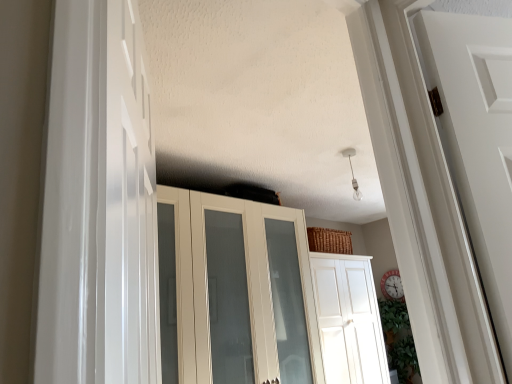
The height and width of the screenshot is (384, 512). Find the location of `white glossy cupboard at center`. white glossy cupboard at center is located at coordinates 247,283.

What do you see at coordinates (349, 319) in the screenshot?
I see `white glossy door at center, the 2th door in the top-to-bottom sequence` at bounding box center [349, 319].

Identify the location of white glossy cupboard at center. (247, 283).

Is white glossy door at left, arranged as the 2th door when viewed from the right, far away from white glossy cupboard at center?

Yes, white glossy door at left, arranged as the 2th door when viewed from the right, and white glossy cupboard at center are located far from each other.

Which object is positioned more to the right, white glossy door at left, arranged as the 2th door when viewed from the right, or white glossy cupboard at center?

white glossy cupboard at center.

You are a GUI agent. You are given a task and a screenshot of the screen. Output one action in this format:
    pyautogui.click(x=<x>, y=<y>)
    Task: Click on the door that is in front of the white glossy cupboard at center
    
    Given the screenshot: What is the action you would take?
    pyautogui.click(x=130, y=207)

Is white glossy door at left, which is counted as the 1th door, starting from the front, turned away from white glossy cupboard at center?

No.

Consider the image. Which object is more forward, white glossy door at left, positioned as the second door in back-to-front order, or white glossy door at center, acting as the second door starting from the left?

white glossy door at left, positioned as the second door in back-to-front order, is in front.

Can you confirm if white glossy door at left, positioned as the second door in back-to-front order, is bigger than white glossy door at center, the 1th door in the back-to-front sequence?

No.

Is white glossy door at left, which is counted as the 1th door, starting from the front, to the left of white glossy door at center, the 2th door positioned from the front, from the viewer's perspective?

Correct, you'll find white glossy door at left, which is counted as the 1th door, starting from the front, to the left of white glossy door at center, the 2th door positioned from the front.

Could you tell me if white glossy door at left, positioned as the second door in back-to-front order, is turned towards white glossy door at center, which appears as the 1th door when ordered from the bottom?

No, white glossy door at left, positioned as the second door in back-to-front order, does not turn towards white glossy door at center, which appears as the 1th door when ordered from the bottom.

Is point (348, 348) behind point (186, 251)?

Yes, point (348, 348) is farther from viewer.

From the image's perspective, who appears lower, white glossy door at center, the 2th door positioned from the front, or white glossy cupboard at center?

white glossy door at center, the 2th door positioned from the front, from the image's perspective.

What's the angular difference between white glossy door at center, which appears as the 1th door when ordered from the bottom, and white glossy cupboard at center's facing directions?

The angle between the facing direction of white glossy door at center, which appears as the 1th door when ordered from the bottom, and the facing direction of white glossy cupboard at center is 0.749 degrees.

Would you consider white glossy door at center, acting as the second door starting from the left, to be distant from white glossy cupboard at center?

white glossy door at center, acting as the second door starting from the left, is actually quite close to white glossy cupboard at center.

Which of these two, white glossy cupboard at center or white glossy door at center, which appears as the 1th door when ordered from the bottom, stands shorter?

Standing shorter between the two is white glossy door at center, which appears as the 1th door when ordered from the bottom.

Considering the relative positions of white glossy cupboard at center and white glossy door at center, the 2th door positioned from the front, in the image provided, is white glossy cupboard at center in front of white glossy door at center, the 2th door positioned from the front,?

That is True.

Is white glossy door at center, the 2th door in the top-to-bottom sequence, surrounded by white glossy cupboard at center?

That's incorrect, white glossy door at center, the 2th door in the top-to-bottom sequence, is not inside white glossy cupboard at center.

Between white glossy door at center, acting as the second door starting from the left, and white glossy door at left, arranged as the 2th door when viewed from the right, which one is positioned behind?

white glossy door at center, acting as the second door starting from the left, is behind.

Locate an element on the screen. door in front of the white glossy door at center, the 2th door positioned from the front is located at coordinates (130, 207).

From the image's perspective, who appears lower, white glossy door at center, marked as the first door in a right-to-left arrangement, or white glossy door at left, positioned as the second door in back-to-front order?

white glossy door at center, marked as the first door in a right-to-left arrangement.

How much distance is there between white glossy door at center, the 2th door positioned from the front, and white glossy door at left, arranged as the 2th door when viewed from the right?

A distance of 2.48 meters exists between white glossy door at center, the 2th door positioned from the front, and white glossy door at left, arranged as the 2th door when viewed from the right.

What's the angular difference between white glossy cupboard at center and white glossy door at left, which is counted as the 1th door, starting from the front,'s facing directions?

The angle between the facing direction of white glossy cupboard at center and the facing direction of white glossy door at left, which is counted as the 1th door, starting from the front, is 56.3 degrees.

The height and width of the screenshot is (384, 512). I want to click on cupboard directly beneath the white glossy door at left, the second door when ordered from bottom to top (from a real-world perspective), so click(x=247, y=283).

Considering the sizes of objects white glossy cupboard at center and white glossy door at left, positioned as the second door in back-to-front order, in the image provided, who is thinner, white glossy cupboard at center or white glossy door at left, positioned as the second door in back-to-front order,?

Thinner between the two is white glossy door at left, positioned as the second door in back-to-front order.

Choose the correct answer: Is white glossy cupboard at center inside white glossy door at left, which is counted as the 1th door, starting from the front, or outside it?

white glossy cupboard at center is outside white glossy door at left, which is counted as the 1th door, starting from the front.

I want to click on cupboard that appears below the white glossy door at left, positioned as the second door in back-to-front order (from the image's perspective), so click(247, 283).

What are the coordinates of `door positioned vertically above the white glossy door at center, the 1th door in the back-to-front sequence (from a real-world perspective)` in the screenshot? It's located at (130, 207).

In the scene shown: From the image, which object appears to be nearer to white glossy cupboard at center, white glossy door at center, marked as the first door in a right-to-left arrangement, or white glossy door at left, which is counted as the 1th door, starting from the front?

Based on the image, white glossy door at center, marked as the first door in a right-to-left arrangement, appears to be nearer to white glossy cupboard at center.

Estimate the real-world distances between objects in this image. Which object is further from white glossy door at center, acting as the second door starting from the left, white glossy cupboard at center or white glossy door at left, the second door when ordered from bottom to top?

Among the two, white glossy door at left, the second door when ordered from bottom to top, is located further to white glossy door at center, acting as the second door starting from the left.

Based on their spatial positions, is white glossy door at left, which is counted as the 1th door, starting from the front, or white glossy cupboard at center closer to white glossy door at center, the 2th door in the top-to-bottom sequence?

The object closer to white glossy door at center, the 2th door in the top-to-bottom sequence, is white glossy cupboard at center.

Looking at the image, which one is located closer to white glossy door at left, the second door when ordered from bottom to top, white glossy door at center, the 2th door positioned from the front, or white glossy cupboard at center?

Among the two, white glossy cupboard at center is located nearer to white glossy door at left, the second door when ordered from bottom to top.

Considering their positions, is white glossy door at left, the first door from the top, positioned closer to white glossy cupboard at center than white glossy door at center, the 1th door in the back-to-front sequence?

white glossy door at center, the 1th door in the back-to-front sequence, is positioned closer to the anchor white glossy cupboard at center.

Which object lies nearer to the anchor point white glossy door at left, the first door from the top, white glossy cupboard at center or white glossy door at center, marked as the first door in a right-to-left arrangement?

white glossy cupboard at center.

You are a GUI agent. You are given a task and a screenshot of the screen. Output one action in this format:
    pyautogui.click(x=<x>, y=<y>)
    Task: Click on the cupboard between white glossy door at left, the first door from the top, and white glossy door at center, the 2th door in the top-to-bottom sequence, in the front-back direction
    The height and width of the screenshot is (384, 512).
    Given the screenshot: What is the action you would take?
    click(247, 283)